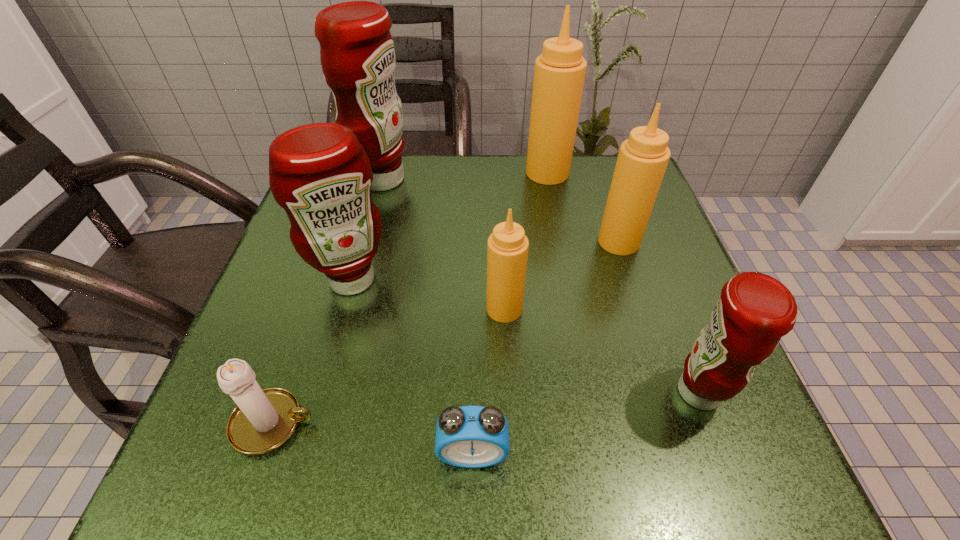
The image size is (960, 540). What are the coordinates of `candle holder` in the screenshot? It's located at (263, 420).

Identify the location of the second shortest object. This screenshot has height=540, width=960. (263, 420).

Locate an element on the screen. alarm clock is located at coordinates (468, 436).

You are a GUI agent. You are given a task and a screenshot of the screen. Output one action in this format:
    pyautogui.click(x=<x>, y=<y>)
    Task: Click on the vacant space located 0.310m on the front of the farthest tan condiment
    This screenshot has width=960, height=540.
    Given the screenshot: What is the action you would take?
    pyautogui.click(x=567, y=276)

Identify the location of blank space located 0.050m on the left of the biggest red condiment. (333, 180).

Where is `free spot located 0.060m on the right of the second smallest tan condiment`? free spot located 0.060m on the right of the second smallest tan condiment is located at coordinates (668, 242).

Where is `free location located 0.230m on the back of the second farthest red condiment`? Image resolution: width=960 pixels, height=540 pixels. free location located 0.230m on the back of the second farthest red condiment is located at coordinates (376, 192).

Locate an element on the screen. Image resolution: width=960 pixels, height=540 pixels. free space located 0.200m on the right of the third condiment from left to right is located at coordinates (633, 309).

At what (x,y) coordinates should I click in order to perform the action: click on vacant area located on the back of the nearest condiment. Please return your answer as a coordinate pair (x, y). Image resolution: width=960 pixels, height=540 pixels. Looking at the image, I should click on (643, 247).

At what (x,y) coordinates should I click in order to perform the action: click on vacant space located on the handle side of the candle holder. Please return your answer as a coordinate pair (x, y). Looking at the image, I should click on (518, 423).